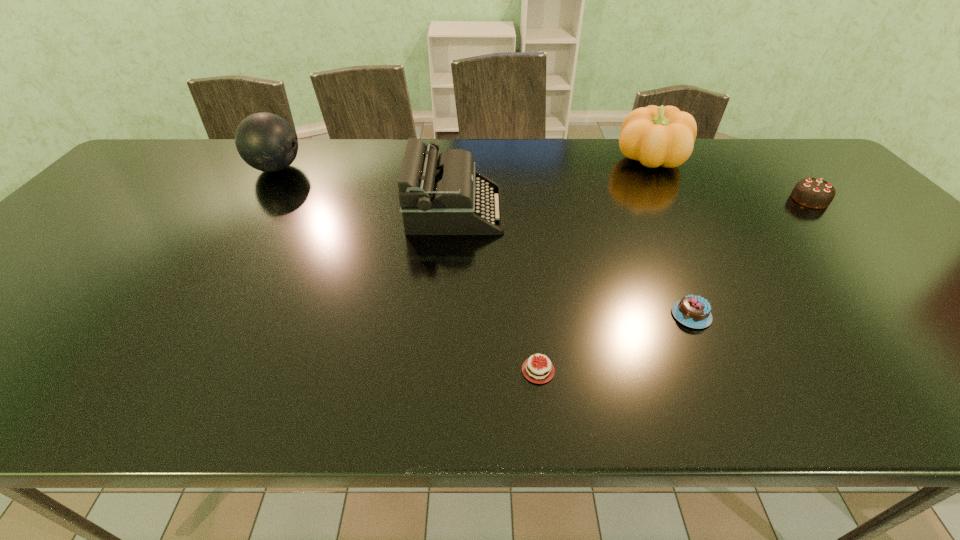
Locate an element on the screen. The height and width of the screenshot is (540, 960). vacant area that lies between the pumpkin and the tallest chocolate cake is located at coordinates (730, 180).

Identify the location of free point between the shortest chocolate cake and the typewriter. (496, 290).

The height and width of the screenshot is (540, 960). I want to click on unoccupied position between the nearest object and the rightmost object, so click(x=674, y=285).

Choose which object is the fifth nearest neighbor to the bowling ball. Please provide its 2D coordinates. Your answer should be formatted as a tuple, i.e. [(x, y)], where the tuple contains the x and y coordinates of a point satisfying the conditions above.

[(814, 193)]

I want to click on the third closest object relative to the pumpkin, so click(693, 311).

Point out which chocolate cake is positioned as the nearest to the rightmost object. Please provide its 2D coordinates. Your answer should be formatted as a tuple, i.e. [(x, y)], where the tuple contains the x and y coordinates of a point satisfying the conditions above.

[(693, 311)]

Locate an element on the screen. The image size is (960, 540). chocolate cake that is the closest one to the typewriter is located at coordinates (535, 370).

Where is `blank area in the image that satisfies the following two spatial constraints: 1. on the back side of the second nearest chocolate cake; 2. on the grip area of the bowling ball`? blank area in the image that satisfies the following two spatial constraints: 1. on the back side of the second nearest chocolate cake; 2. on the grip area of the bowling ball is located at coordinates (625, 168).

Where is `vacant space that satisfies the following two spatial constraints: 1. on the grip area of the bowling ball; 2. on the back side of the nearest chocolate cake`? This screenshot has width=960, height=540. vacant space that satisfies the following two spatial constraints: 1. on the grip area of the bowling ball; 2. on the back side of the nearest chocolate cake is located at coordinates (147, 370).

Identify the location of vacant region that satisfies the following two spatial constraints: 1. on the grip area of the shortest object; 2. on the left side of the bowling ball. (147, 370).